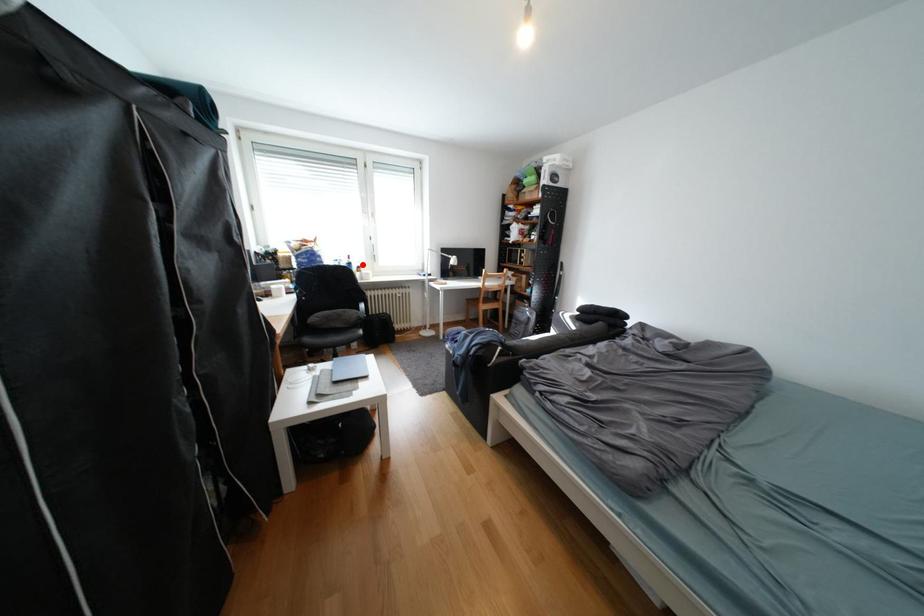
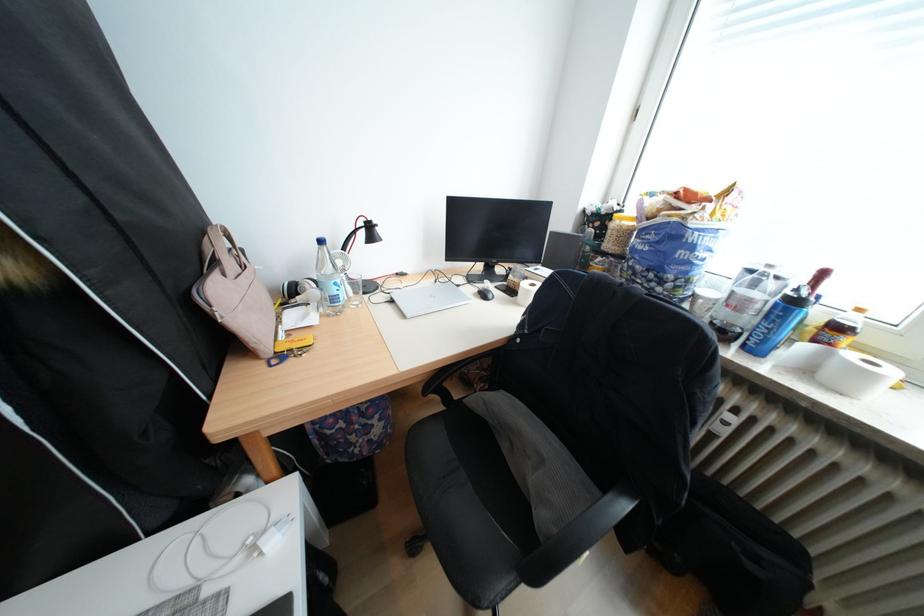
Where in the second image is the point corresponding to the highlighted location from the first image?

(808, 302)